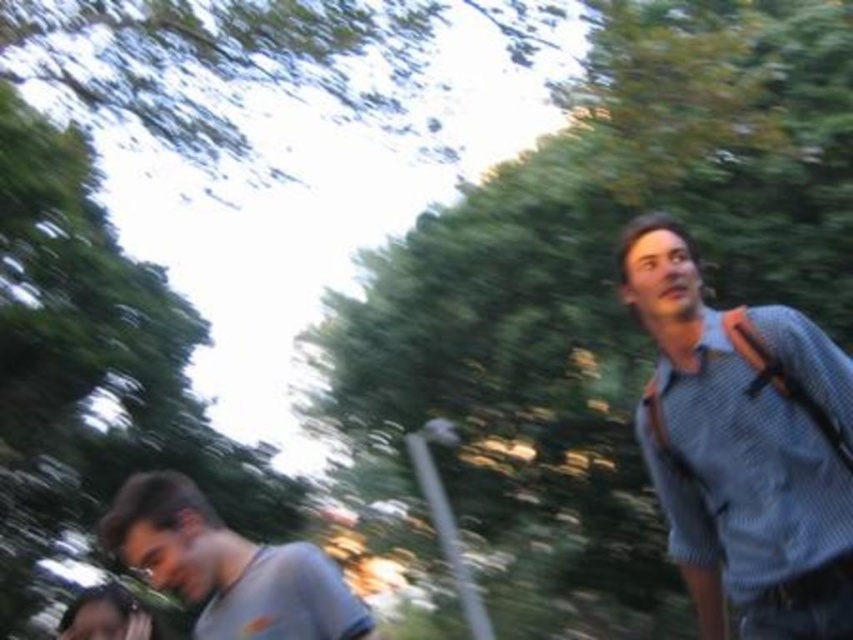
Question: Where is textured blue shirt at right located in relation to gray cotton shirt at lower left in the image?

Choices:
 (A) below
 (B) above

Answer: (B)

Question: Which point is closer to the camera taking this photo?

Choices:
 (A) (236, 608)
 (B) (827, 406)

Answer: (B)

Question: Which point appears farthest from the camera in this image?

Choices:
 (A) (786, 337)
 (B) (341, 605)

Answer: (A)

Question: Can you confirm if textured blue shirt at right is positioned below gray cotton shirt at lower left?

Choices:
 (A) yes
 (B) no

Answer: (B)

Question: Where is textured blue shirt at right located in relation to gray cotton shirt at lower left in the image?

Choices:
 (A) right
 (B) left

Answer: (A)